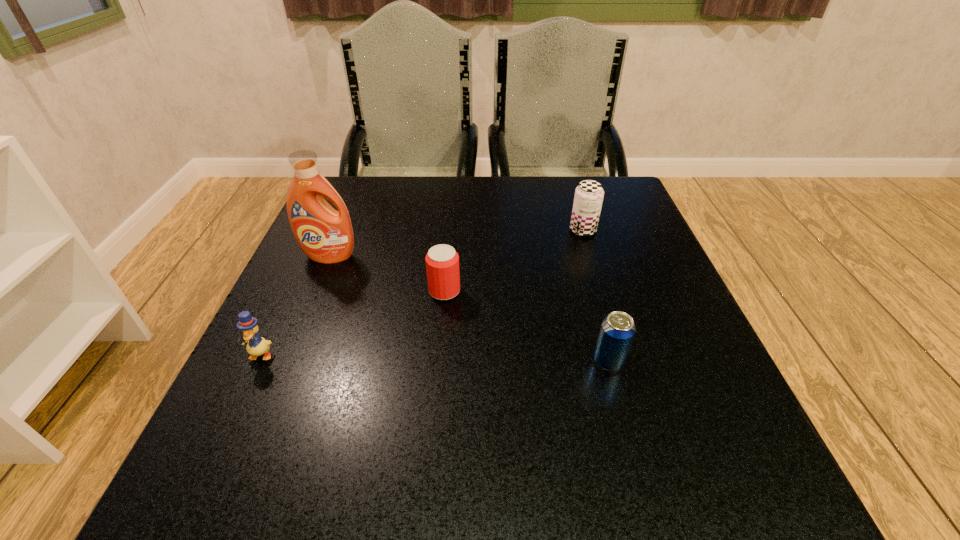
Find the location of `the second farthest object`. the second farthest object is located at coordinates (325, 235).

Where is `the tallest object`? The image size is (960, 540). the tallest object is located at coordinates (325, 235).

The width and height of the screenshot is (960, 540). What are the coordinates of `the farthest object` in the screenshot? It's located at (589, 194).

In order to click on the fourth shortest object in this screenshot , I will do `click(589, 194)`.

This screenshot has height=540, width=960. In order to click on the nearest beer can in this screenshot , I will do `click(617, 331)`.

The width and height of the screenshot is (960, 540). I want to click on the leftmost beer can, so click(442, 261).

This screenshot has width=960, height=540. Find the location of `the second farthest beer can`. the second farthest beer can is located at coordinates (442, 261).

The height and width of the screenshot is (540, 960). I want to click on duckling, so click(x=256, y=346).

Identify the location of vacant region located 0.320m on the front-facing side of the tallest object. The height and width of the screenshot is (540, 960). (272, 396).

Find the location of a particular element. vacant space located 0.120m on the left of the farthest beer can is located at coordinates (516, 231).